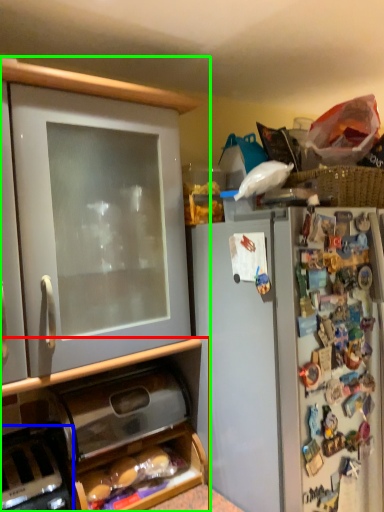
Question: Which object is the closest to the cabinetry (highlighted by a red box)? Choose among these: appliance (highlighted by a blue box) or cabinetry (highlighted by a green box).

Choices:
 (A) appliance
 (B) cabinetry

Answer: (B)